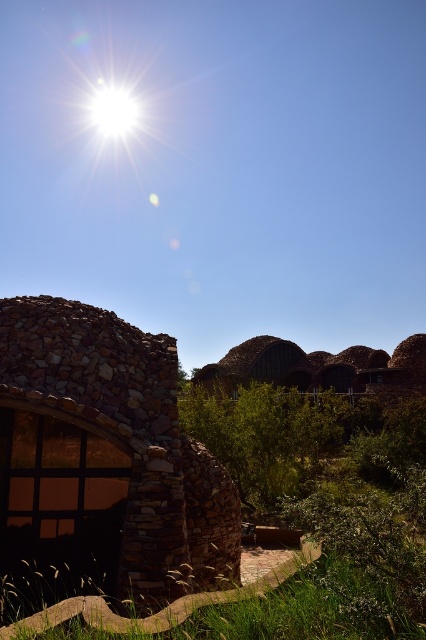
You are standing at the edge of the green grass at lower center and want to reach the rustic stone hut at left. Which direction should you walk to avoid stepping on the grass?

The rustic stone hut at left is positioned over the green grass at lower center. To avoid stepping on the grass, you should walk around the grass area towards the hut.

You are standing on the green grass at lower center and want to enter the rustic stone hut at center. Which direction should you walk to reach it?

The rustic stone hut at center is positioned over the green grass at lower center, so you should walk upward or towards the center to reach it.